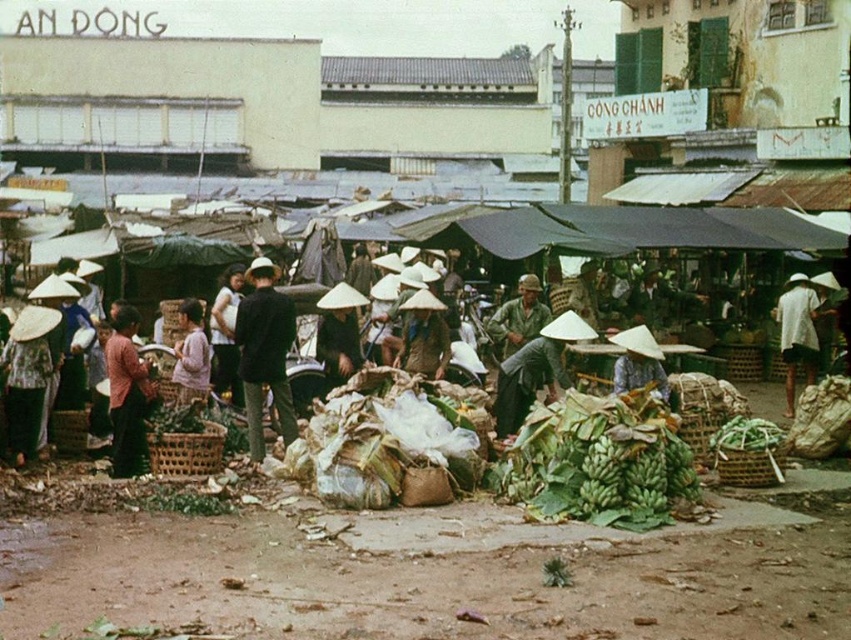
You are standing at the entrance of the market and notice two points in the scene. The first point is at coordinates point (256,269) and the second is at point (307,285). Which of these two points is closer to your current position?

Point (256,269) is closer to the camera than point (307,285), so it is closer to your current position.

In the bustling outdoor market scene with the AN DONG sign at the top left, you notice a matte pink shirt at left and a matte brown woven basket at center. Which object is positioned more to the left?

The matte pink shirt at left is positioned more to the left than the matte brown woven basket at center.